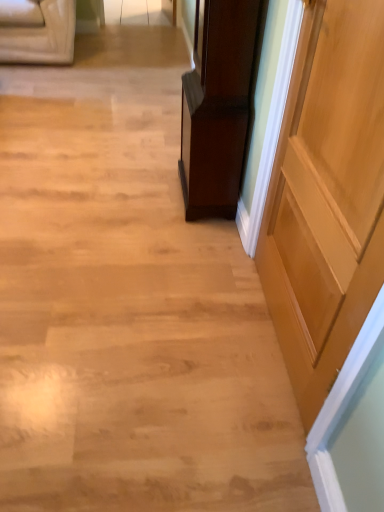
Question: From a real-world perspective, is light brown wood door at right physically located above or below shiny dark wood cabinet at center?

Choices:
 (A) below
 (B) above

Answer: (B)

Question: Would you say light brown wood door at right is inside or outside shiny dark wood cabinet at center?

Choices:
 (A) inside
 (B) outside

Answer: (B)

Question: From the image's perspective, is light brown wood door at right located above or below shiny dark wood cabinet at center?

Choices:
 (A) below
 (B) above

Answer: (A)

Question: In terms of height, does shiny dark wood cabinet at center look taller or shorter compared to light brown wood door at right?

Choices:
 (A) tall
 (B) short

Answer: (B)

Question: From a real-world perspective, relative to light brown wood door at right, is shiny dark wood cabinet at center vertically above or below?

Choices:
 (A) below
 (B) above

Answer: (A)

Question: Is shiny dark wood cabinet at center inside the boundaries of light brown wood door at right, or outside?

Choices:
 (A) inside
 (B) outside

Answer: (B)

Question: In terms of size, does shiny dark wood cabinet at center appear bigger or smaller than light brown wood door at right?

Choices:
 (A) small
 (B) big

Answer: (B)